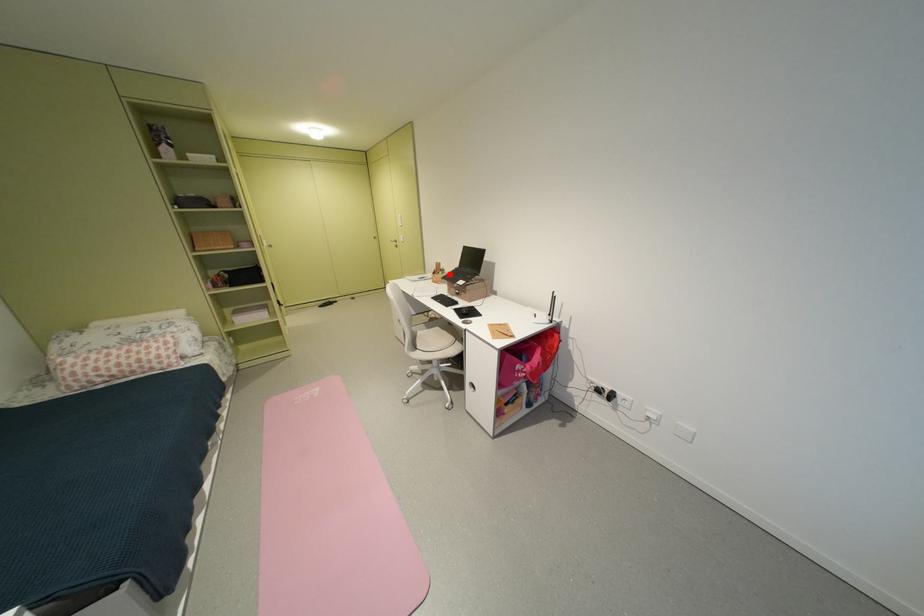
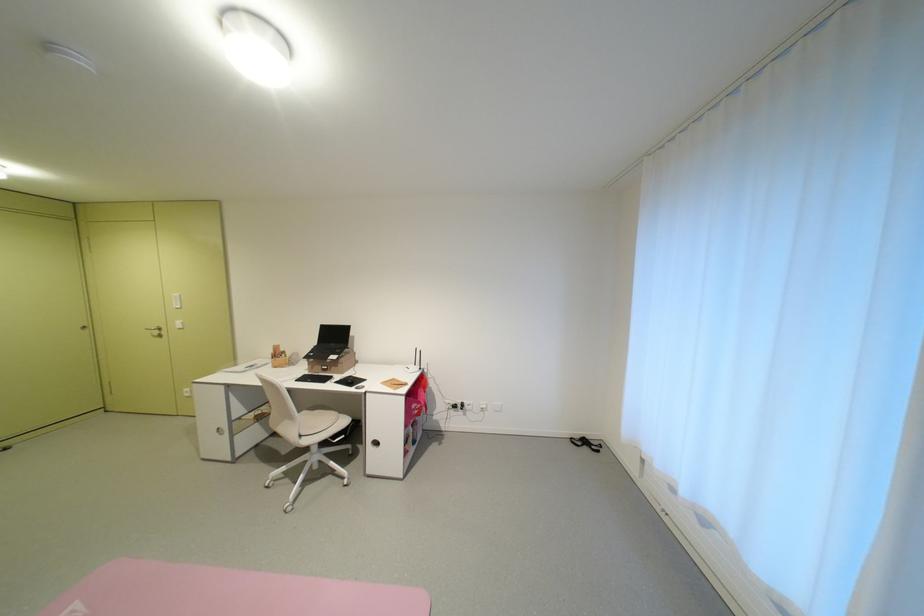
Find the pixel in the second image that matches the highlighted location in the first image.

(293, 357)